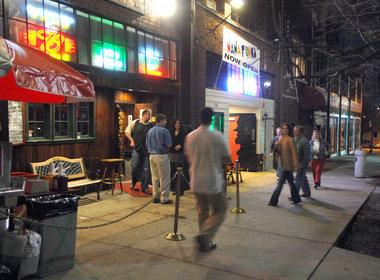
The width and height of the screenshot is (380, 280). What are the coordinates of `red rug` in the screenshot? It's located at (138, 191).